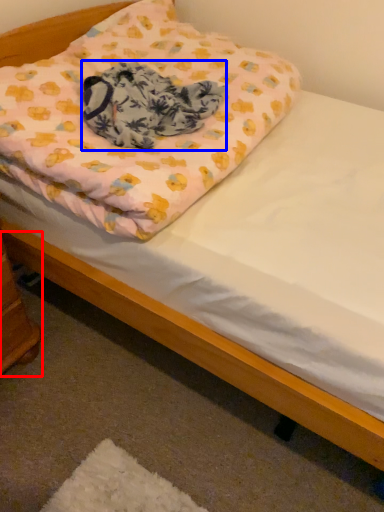
Question: Which point is further to the camera, changing table (highlighted by a red box) or blanket (highlighted by a blue box)?

Choices:
 (A) changing table
 (B) blanket

Answer: (B)